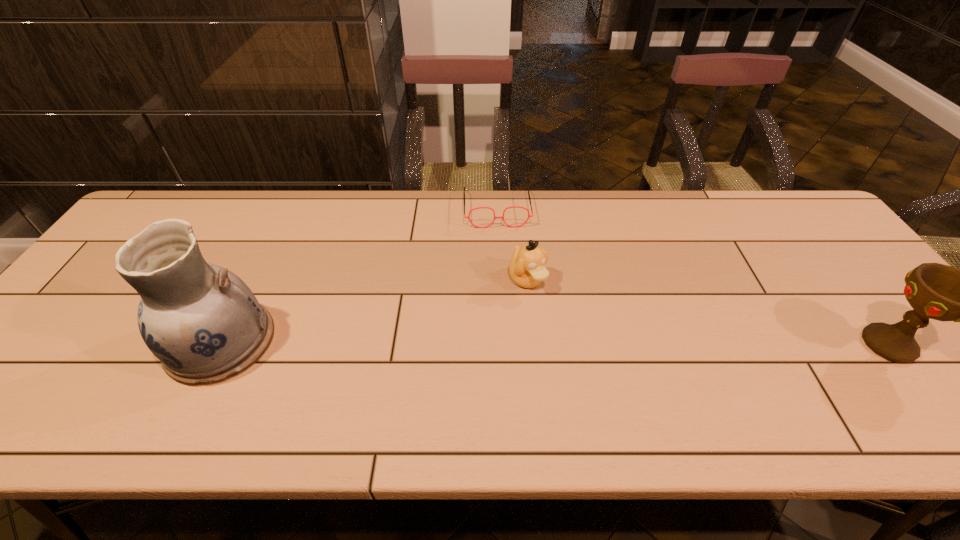
Where is `free space on the desktop that is between the pottery and the rightmost object and is positioned on the face of the third tallest object`? The height and width of the screenshot is (540, 960). free space on the desktop that is between the pottery and the rightmost object and is positioned on the face of the third tallest object is located at coordinates (581, 343).

Where is `free space on the desktop that is between the tallest object and the rightmost object and is positioned on the front-facing side of the shortest object`? The height and width of the screenshot is (540, 960). free space on the desktop that is between the tallest object and the rightmost object and is positioned on the front-facing side of the shortest object is located at coordinates point(510,343).